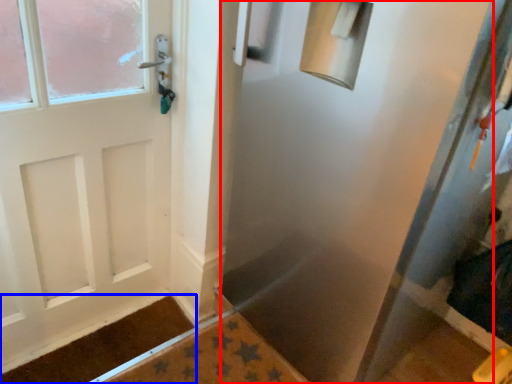
Question: Among these objects, which one is farthest to the camera, screen door (highlighted by a red box) or doormat (highlighted by a blue box)?

Choices:
 (A) screen door
 (B) doormat

Answer: (B)